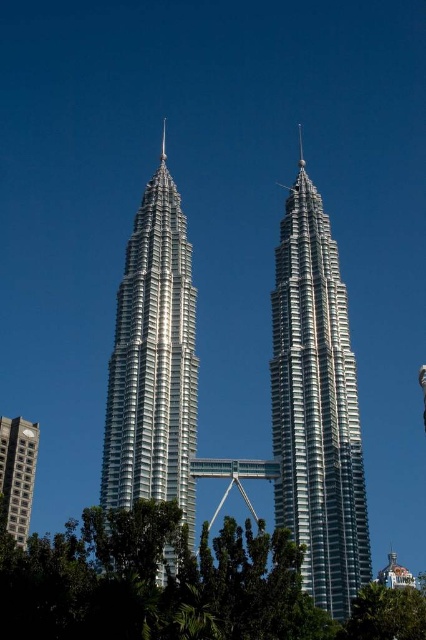
You are an architect analyzing the Petronas Twin Towers. You notice the silver metallic tower at center and the silver metallic spire at upper center. Which of these two structures is bigger in size?

The silver metallic tower at center is larger in size compared to the silver metallic spire at upper center.

You are a drone operator who needs to fly a drone from the green leafy tree at center to the silver metallic building at center. According to the scene, which direction should you fly the drone to reach the building?

The green leafy tree at center is located below the silver metallic building at center, so you should fly the drone upward to reach the silver metallic building at center.